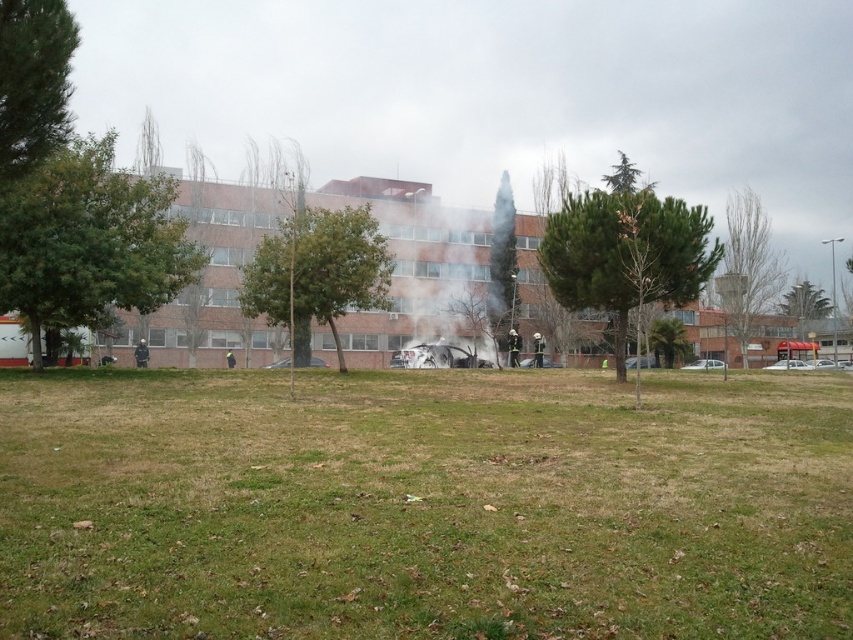
Does green grass at center appear over bare branches at right?

No.

Is green grass at center thinner than bare branches at right?

Yes, green grass at center is thinner than bare branches at right.

Who is more forward, [405,509] or [740,275]?

Point [405,509] is more forward.

You are a GUI agent. You are given a task and a screenshot of the screen. Output one action in this format:
    pyautogui.click(x=<x>, y=<y>)
    Task: Click on the green grass at center
    Image resolution: width=853 pixels, height=640 pixels.
    Given the screenshot: What is the action you would take?
    pyautogui.click(x=422, y=506)

Does green leafy tree at left have a greater height compared to bare branches at right?

No.

Can you confirm if green leafy tree at left is smaller than bare branches at right?

Yes.

Where is `green leafy tree at left`? This screenshot has height=640, width=853. green leafy tree at left is located at coordinates (90, 241).

Who is higher up, green textured tree at center or bare branches at right?

bare branches at right is above.

Who is more forward, (552, 241) or (747, 256)?

Positioned in front is point (552, 241).

Where is `green textured tree at center`? green textured tree at center is located at coordinates (625, 253).